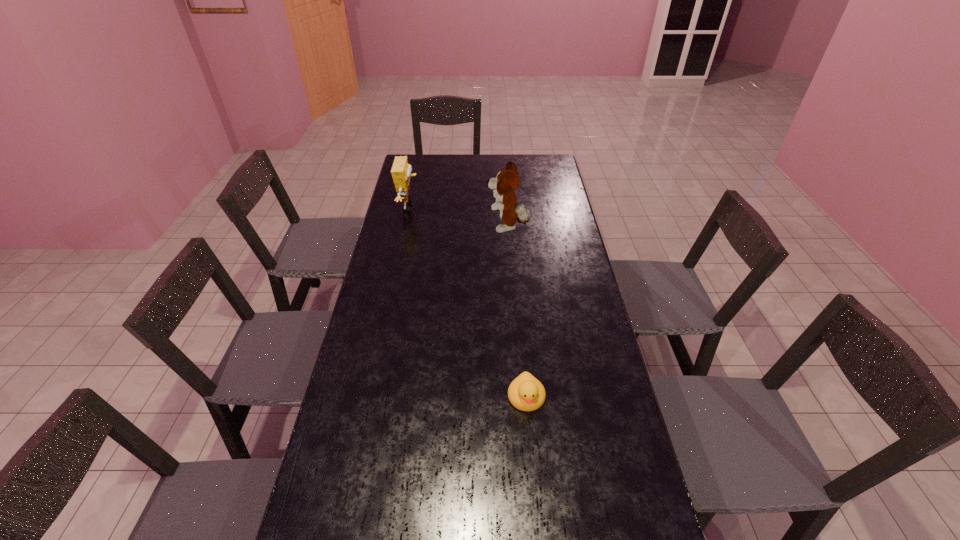
I want to click on puppy, so click(507, 181).

This screenshot has width=960, height=540. I want to click on the second shortest object, so click(401, 171).

This screenshot has height=540, width=960. In order to click on sponge in this screenshot , I will do `click(401, 171)`.

Find the location of `duckling`. duckling is located at coordinates (526, 393).

What are the coordinates of `the nearest object` in the screenshot? It's located at (526, 393).

Identify the location of vacant area situated 0.380m on the face of the tallest object. The height and width of the screenshot is (540, 960). (392, 228).

What are the coordinates of `free space located 0.160m on the face of the tallest object` in the screenshot? It's located at (446, 228).

Where is `vacant region located 0.240m on the face of the tallest object`? vacant region located 0.240m on the face of the tallest object is located at coordinates (427, 228).

In order to click on vacant area situated on the face of the second shortest object in this screenshot , I will do `click(457, 207)`.

I want to click on vacant space situated 0.260m on the face of the shortest object, so click(x=538, y=524).